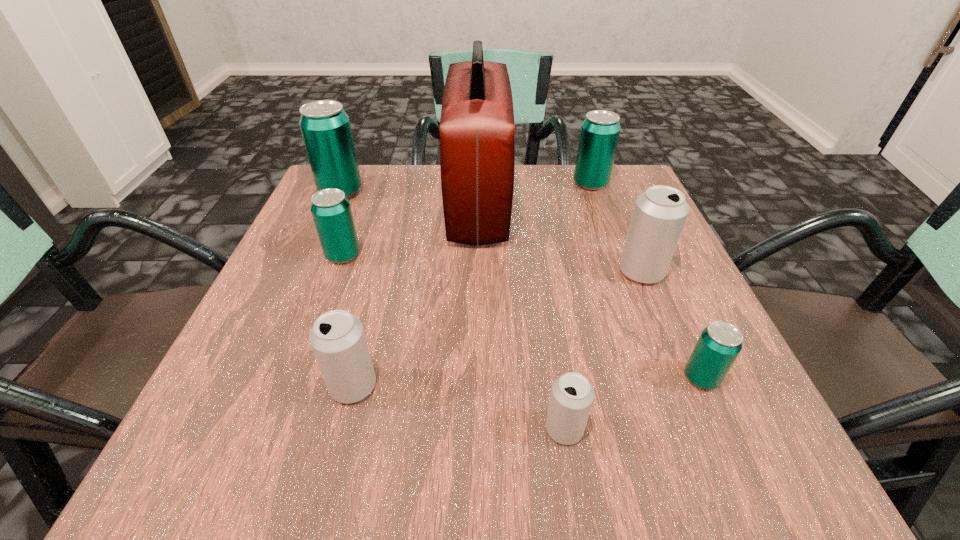
The image size is (960, 540). In order to click on beer can that is the second nearest to the second tallest object in this screenshot , I will do tap(338, 340).

The height and width of the screenshot is (540, 960). Identify the location of beer can that is the fourth closest one to the second smallest teal beer can. (659, 215).

Locate an element on the screen. teal beer can that is the closest to the biggest white beer can is located at coordinates (719, 344).

Identify which teal beer can is the third closest to the second nearest teal beer can. Please provide its 2D coordinates. Your answer should be formatted as a tuple, i.e. [(x, y)], where the tuple contains the x and y coordinates of a point satisfying the conditions above.

[(719, 344)]

Identify the location of white beer can that is the closest to the first aid kit. This screenshot has height=540, width=960. (659, 215).

Locate an element on the screen. the second closest white beer can to the tallest beer can is located at coordinates (659, 215).

The image size is (960, 540). Find the location of `vacant point that satisfies the following two spatial constraints: 1. on the front side of the biggest teal beer can; 2. on the right side of the smallest teal beer can`. vacant point that satisfies the following two spatial constraints: 1. on the front side of the biggest teal beer can; 2. on the right side of the smallest teal beer can is located at coordinates (258, 378).

I want to click on vacant space that satisfies the following two spatial constraints: 1. on the side of the first aid kit with the cross symbol; 2. on the left side of the nearest teal beer can, so click(x=477, y=378).